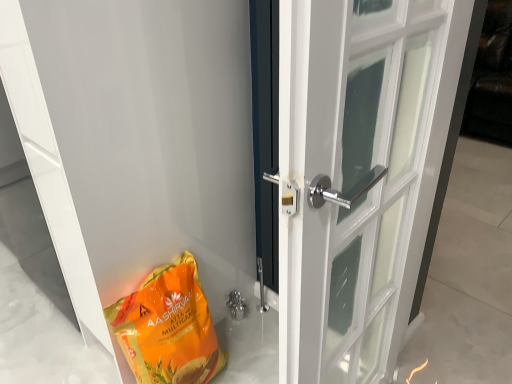
Question: Considering the positions of orange matte/glossy grocery bag at lower left and polished chrome door handle at center, marked as the second door in a left-to-right arrangement, in the image, is orange matte/glossy grocery bag at lower left wider or thinner than polished chrome door handle at center, marked as the second door in a left-to-right arrangement,?

Choices:
 (A) wide
 (B) thin

Answer: (B)

Question: In terms of size, does orange matte/glossy grocery bag at lower left appear bigger or smaller than polished chrome door handle at center, which is the first door in right-to-left order?

Choices:
 (A) small
 (B) big

Answer: (A)

Question: Which object is positioned farthest from the polished chrome door handle at center, which is the first door in right-to-left order?

Choices:
 (A) white glossy door at lower left, positioned as the second door in right-to-left order
 (B) orange matte/glossy grocery bag at lower left

Answer: (B)

Question: Based on their relative distances, which object is nearer to the white glossy door at lower left, positioned as the first door in left-to-right order?

Choices:
 (A) orange matte/glossy grocery bag at lower left
 (B) polished chrome door handle at center, marked as the second door in a left-to-right arrangement

Answer: (A)